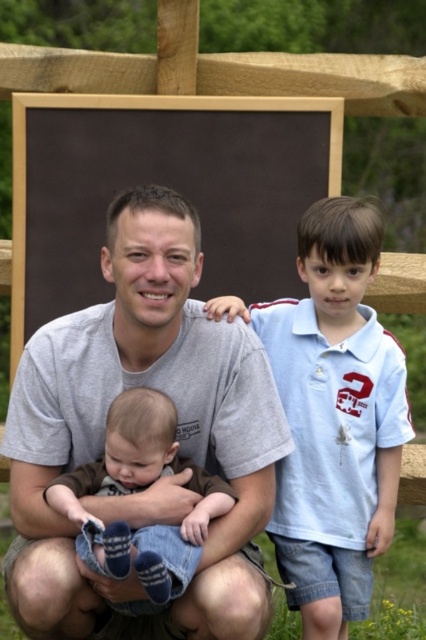
Between gray cotton t-shirt at center and light blue cotton shirt at right, which one appears on the right side from the viewer's perspective?

light blue cotton shirt at right is more to the right.

Does point (14, 550) come in front of point (344, 532)?

That is False.

Is point (233, 544) positioned before point (268, 307)?

Yes, point (233, 544) is in front of point (268, 307).

Where is `gray cotton t-shirt at center`? The image size is (426, 640). gray cotton t-shirt at center is located at coordinates (178, 433).

Does point (140, 316) come farther from viewer compared to point (150, 416)?

Yes.

Describe the element at coordinates (178, 433) in the screenshot. I see `gray cotton t-shirt at center` at that location.

Is point (48, 465) closer to viewer compared to point (199, 515)?

No, it is behind (199, 515).

In order to click on gray cotton t-shirt at center in this screenshot , I will do `click(178, 433)`.

Can you confirm if light blue cotton shirt at right is positioned to the right of soft brown fabric baby at center?

Indeed, light blue cotton shirt at right is positioned on the right side of soft brown fabric baby at center.

Is point (328, 273) behind point (108, 572)?

Yes, point (328, 273) is behind point (108, 572).

You are a GUI agent. You are given a task and a screenshot of the screen. Output one action in this format:
    pyautogui.click(x=<x>, y=<y>)
    Task: Click on the light blue cotton shirt at right
    The width and height of the screenshot is (426, 640).
    Given the screenshot: What is the action you would take?
    [x=333, y=417]